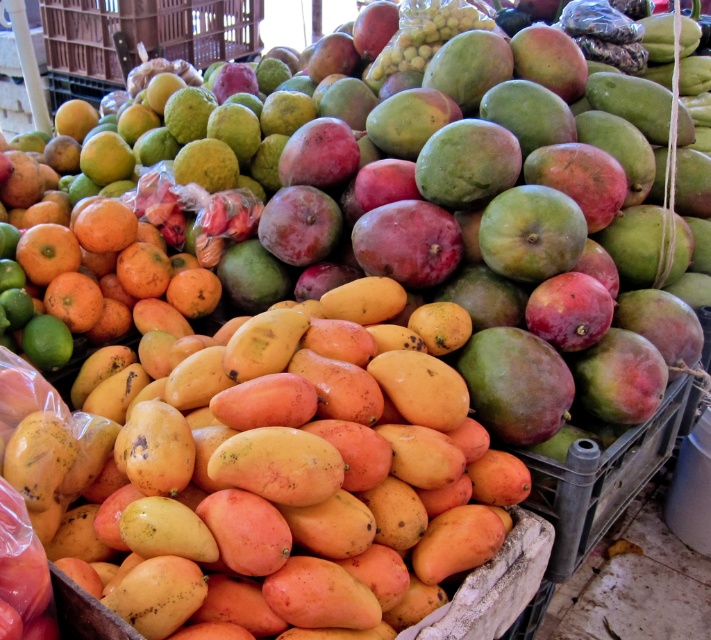
Can you confirm if yellow matte mango at center is bigger than orange matte/orange at left?

Yes.

Find the location of a particular element. yellow matte mango at center is located at coordinates (267, 477).

Identify the location of yellow matte mango at center. (267, 477).